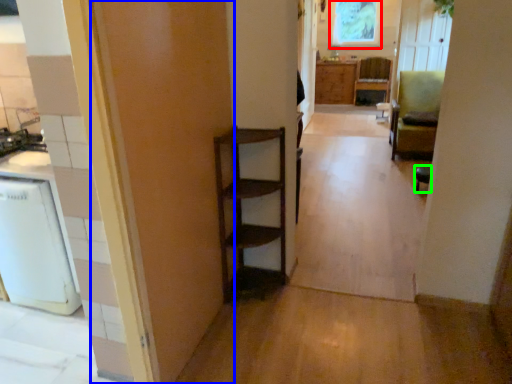
Question: Based on their relative distances, which object is farther from window screen (highlighted by a red box)? Choose from door (highlighted by a blue box) and chair (highlighted by a green box).

Choices:
 (A) door
 (B) chair

Answer: (A)